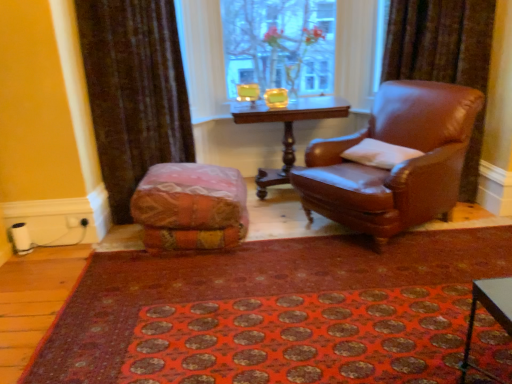
Question: Is brown leather chair at right taller than white soft pillow at right?

Choices:
 (A) yes
 (B) no

Answer: (A)

Question: Does brown leather chair at right have a lesser height compared to white soft pillow at right?

Choices:
 (A) no
 (B) yes

Answer: (A)

Question: Is the depth of brown leather chair at right greater than that of white soft pillow at right?

Choices:
 (A) yes
 (B) no

Answer: (B)

Question: From a real-world perspective, is brown leather chair at right over white soft pillow at right?

Choices:
 (A) yes
 (B) no

Answer: (B)

Question: Would you say brown leather chair at right is outside white soft pillow at right?

Choices:
 (A) no
 (B) yes

Answer: (B)

Question: Which is correct: wooden polished table at center is inside transparent glass vase at upper center, or outside of it?

Choices:
 (A) outside
 (B) inside

Answer: (A)

Question: From the image's perspective, is wooden polished table at center positioned above or below transparent glass vase at upper center?

Choices:
 (A) above
 (B) below

Answer: (B)

Question: From a real-world perspective, is wooden polished table at center positioned above or below transparent glass vase at upper center?

Choices:
 (A) below
 (B) above

Answer: (A)

Question: Relative to transparent glass vase at upper center, is wooden polished table at center in front or behind?

Choices:
 (A) front
 (B) behind

Answer: (A)

Question: From the image's perspective, is brown leather chair at right positioned above or below textured multicolored bean bag at center?

Choices:
 (A) below
 (B) above

Answer: (B)

Question: From a real-world perspective, is brown leather chair at right positioned above or below textured multicolored bean bag at center?

Choices:
 (A) below
 (B) above

Answer: (B)

Question: From their relative heights in the image, would you say brown leather chair at right is taller or shorter than textured multicolored bean bag at center?

Choices:
 (A) short
 (B) tall

Answer: (B)

Question: Do you think brown leather chair at right is within textured multicolored bean bag at center, or outside of it?

Choices:
 (A) inside
 (B) outside

Answer: (B)

Question: Does point [192, 208] appear closer or farther from the camera than point [418, 175]?

Choices:
 (A) farther
 (B) closer

Answer: (A)

Question: Is textured multicolored bean bag at center in front of or behind brown leather chair at right in the image?

Choices:
 (A) behind
 (B) front

Answer: (A)